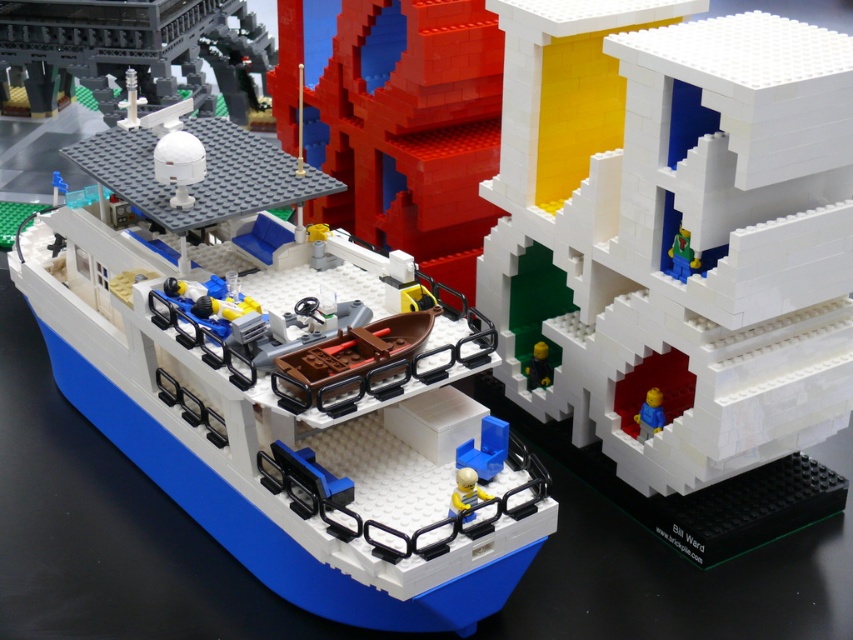
Question: Does smooth red boat at center come behind light blue plastic minifigure at center?

Choices:
 (A) no
 (B) yes

Answer: (B)

Question: Estimate the real-world distances between objects in this image. Which object is farther from the blue matte boat at center?

Choices:
 (A) green matte figure at center-right
 (B) light blue plastic minifigure at center

Answer: (A)

Question: Which point appears farthest from the camera in this image?

Choices:
 (A) (468, 474)
 (B) (315, 212)
 (C) (695, 260)

Answer: (B)

Question: Is white matte building at center-right above smooth red boat at center?

Choices:
 (A) no
 (B) yes

Answer: (A)

Question: Does blue matte boat at center appear on the left side of light blue plastic minifigure at center?

Choices:
 (A) yes
 (B) no

Answer: (A)

Question: Which of the following is the farthest from the observer?

Choices:
 (A) (463, 468)
 (B) (831, 136)
 (C) (688, 244)
 (D) (132, 24)

Answer: (D)